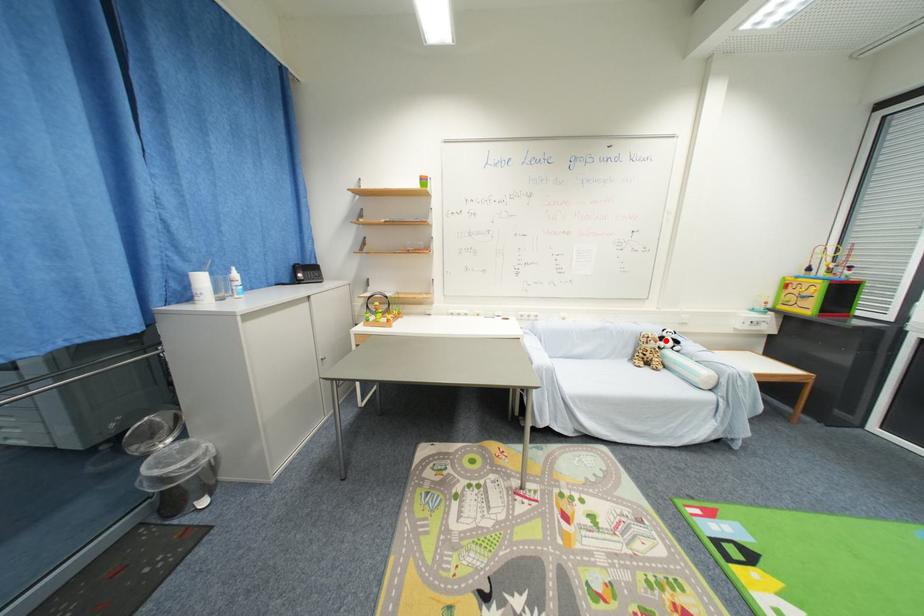
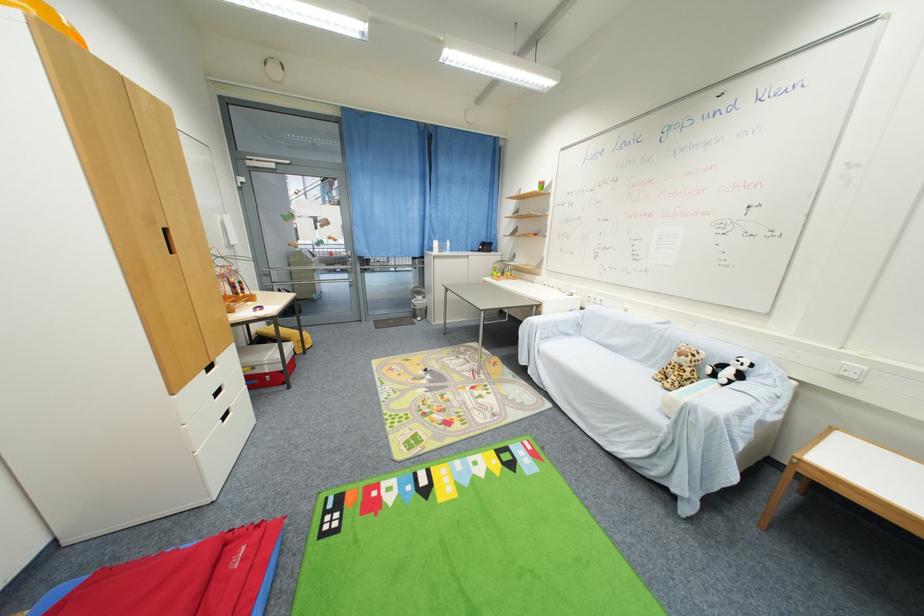
Where in the second image is the point corresponding to the highlighted location from the first image?

(727, 368)